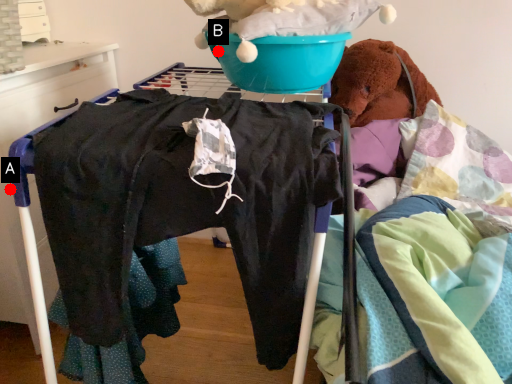
Question: Two points are circled on the image, labeled by A and B beside each circle. Which point is farther to the camera?

Choices:
 (A) A is further
 (B) B is further

Answer: (A)